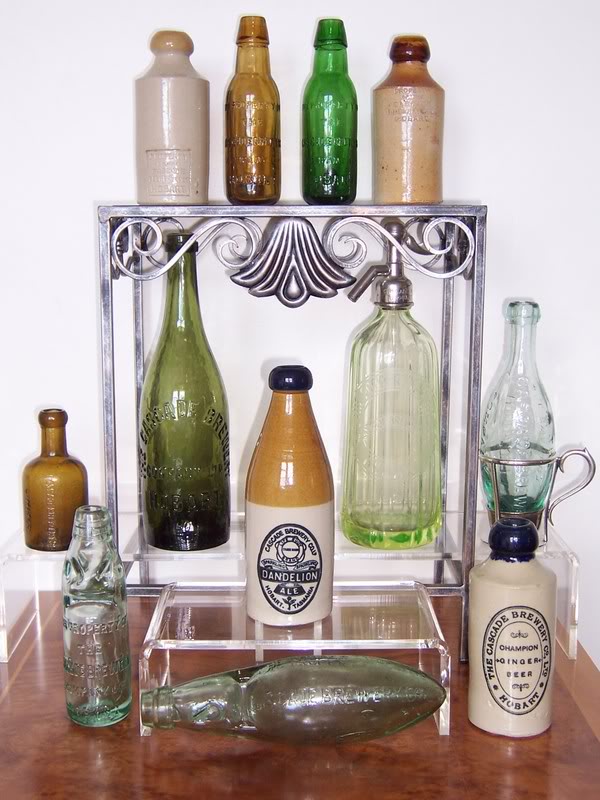
Find the location of a particular element. This screenshot has width=600, height=800. white wall is located at coordinates (61, 160).